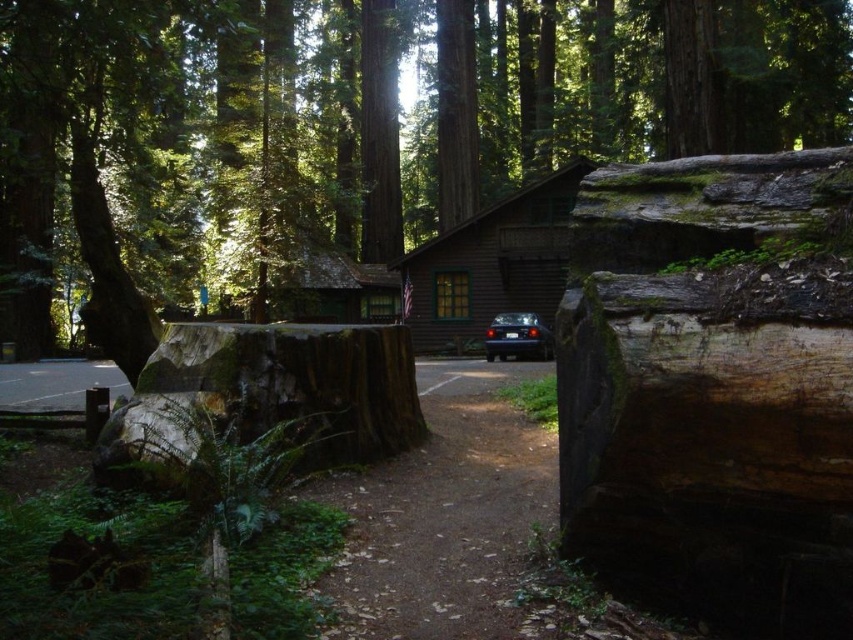
Question: Considering the relative positions of smooth bark log at center and brown wooden cabin at center in the image provided, where is smooth bark log at center located with respect to brown wooden cabin at center?

Choices:
 (A) above
 (B) below

Answer: (A)

Question: Which is nearer to the smooth brown tree trunk at left?

Choices:
 (A) smooth bark log at center
 (B) brown wooden cabin at center
 (C) metallic blue car at center

Answer: (A)

Question: Which object is positioned closest to the metallic blue car at center?

Choices:
 (A) smooth bark log at center
 (B) brown wooden cabin at center

Answer: (B)

Question: Does brown wooden cabin at center appear on the right side of smooth brown tree trunk at left?

Choices:
 (A) no
 (B) yes

Answer: (B)

Question: Among these objects, which one is nearest to the camera?

Choices:
 (A) metallic blue car at center
 (B) smooth brown tree trunk at left
 (C) brown wooden cabin at center
 (D) smooth bark log at center

Answer: (D)

Question: Does brown wooden cabin at center appear over metallic blue car at center?

Choices:
 (A) no
 (B) yes

Answer: (B)